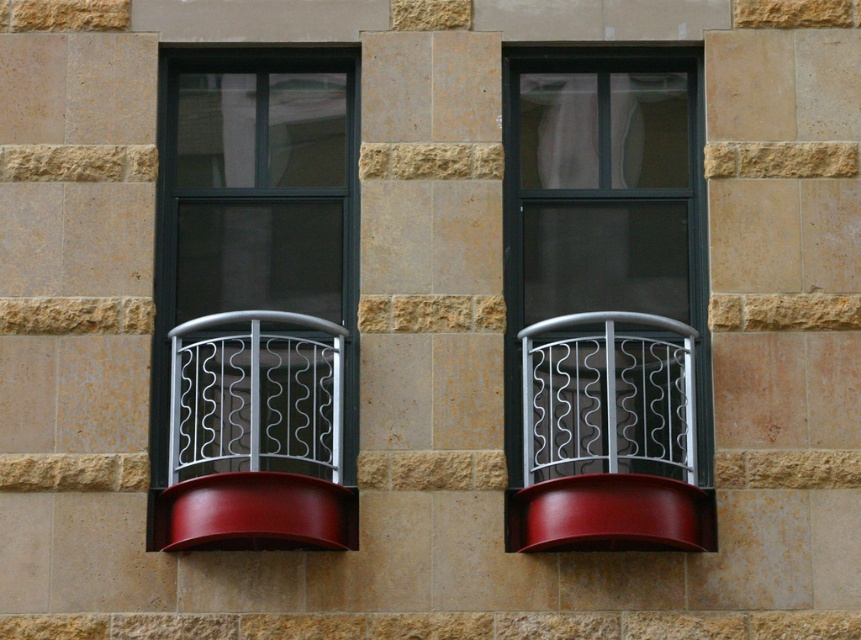
You are an interior designer assessing the symmetry of the bay windows. Which object, the metallic silver railing at center or the white sheer curtain at upper right, would you say is larger in size?

The metallic silver railing at center is bigger than the white sheer curtain at upper right, so the railing is larger in size.

You are standing in front of the bay windows and notice the metallic silver railing at center and the white sheer curtain at upper right. Which object is positioned to the right side from your viewpoint?

The metallic silver railing at center is to the right of the white sheer curtain at upper right, so the metallic silver railing at center is positioned to the right side from your viewpoint.

You are an interior designer assessing the symmetry of the room. The scene has a matte black window at center and a white sheer curtain at upper right. Which object is taller?

The matte black window at center is taller than the white sheer curtain at upper right.